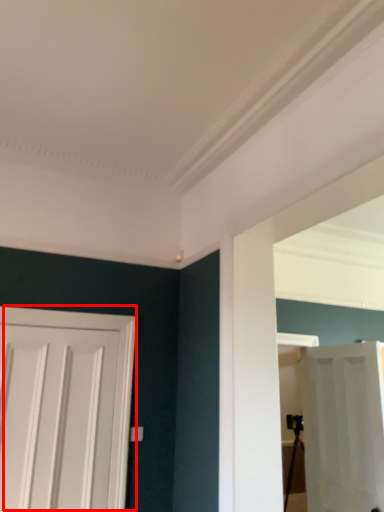
Question: From the image's perspective, considering the relative positions of door (annotated by the red box) and door in the image provided, where is door (annotated by the red box) located with respect to the staircase?

Choices:
 (A) below
 (B) above

Answer: (B)